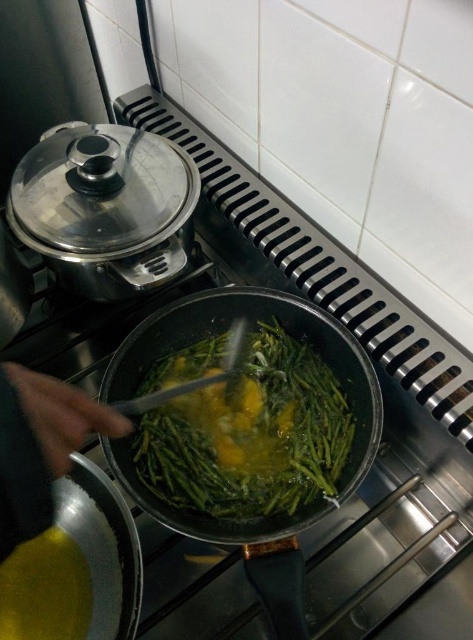
Question: From the image, what is the correct spatial relationship of green matte vegetables at center in relation to skinny yellow hand at lower left?

Choices:
 (A) below
 (B) above

Answer: (A)

Question: Which point is farther from the camera taking this photo?

Choices:
 (A) (163, 499)
 (B) (262, 372)

Answer: (B)

Question: Is non-stick dark green frying pan at center wider than green matte vegetables at center?

Choices:
 (A) yes
 (B) no

Answer: (A)

Question: Which object appears closest to the camera in this image?

Choices:
 (A) skinny yellow hand at lower left
 (B) green matte vegetables at center

Answer: (A)

Question: Which object appears closest to the camera in this image?

Choices:
 (A) non-stick dark green frying pan at center
 (B) green matte vegetables at center

Answer: (A)

Question: In this image, where is non-stick dark green frying pan at center located relative to skinny yellow hand at lower left?

Choices:
 (A) right
 (B) left

Answer: (A)